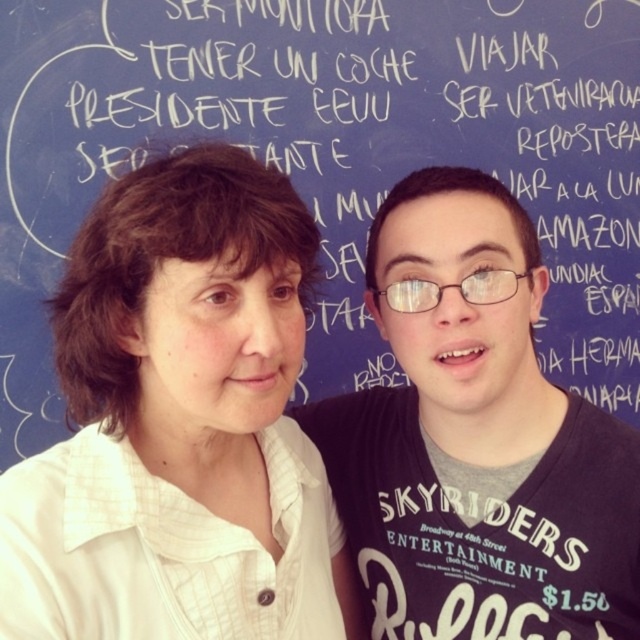
Can you confirm if white textured shirt at upper left is thinner than dark gray cotton shirt at center?

Yes, white textured shirt at upper left is thinner than dark gray cotton shirt at center.

Is white textured shirt at upper left below dark gray cotton shirt at center?

Indeed, white textured shirt at upper left is positioned under dark gray cotton shirt at center.

This screenshot has width=640, height=640. I want to click on white textured shirt at upper left, so [180, 424].

Locate an element on the screen. The width and height of the screenshot is (640, 640). white textured shirt at upper left is located at coordinates (180, 424).